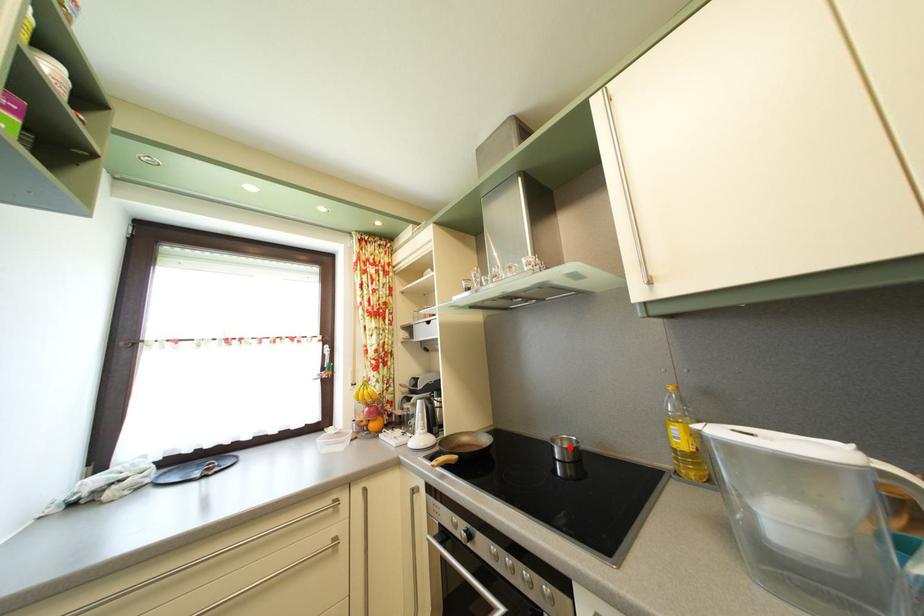
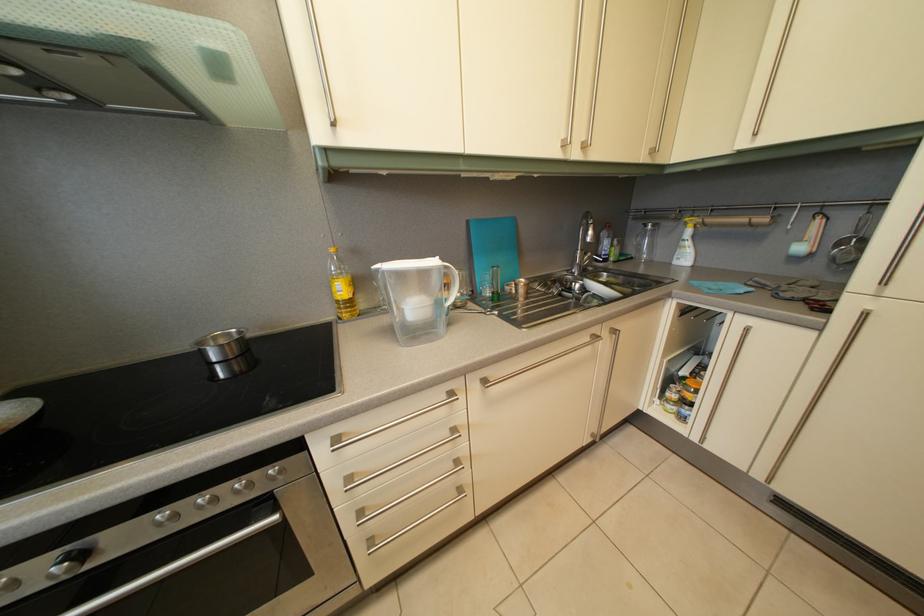
Where in the second image is the point corresponding to the highlighted location from the first image?

(224, 346)